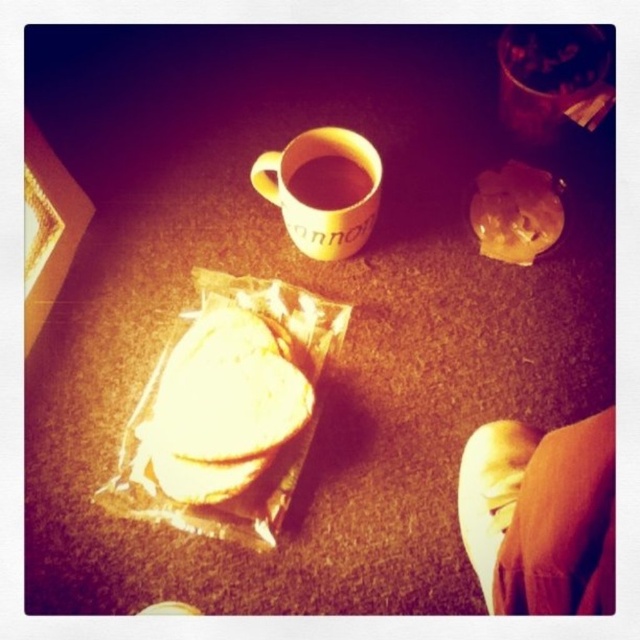
Question: Based on their relative distances, which object is nearer to the matte ceramic mug at upper center?

Choices:
 (A) yellow matte mug at center
 (B) white paper sandwich at center

Answer: (A)

Question: Among these points, which one is farthest from the camera?

Choices:
 (A) (314, 186)
 (B) (337, 141)
 (C) (264, 378)

Answer: (A)

Question: Does white paper sandwich at center appear on the right side of matte ceramic mug at upper center?

Choices:
 (A) yes
 (B) no

Answer: (B)

Question: Does white paper sandwich at center appear over matte ceramic mug at upper center?

Choices:
 (A) no
 (B) yes

Answer: (A)

Question: Can you confirm if white paper sandwich at center is positioned below matte ceramic mug at upper center?

Choices:
 (A) yes
 (B) no

Answer: (A)

Question: Which object is the farthest from the yellow matte mug at center?

Choices:
 (A) white paper sandwich at center
 (B) matte ceramic mug at upper center

Answer: (A)